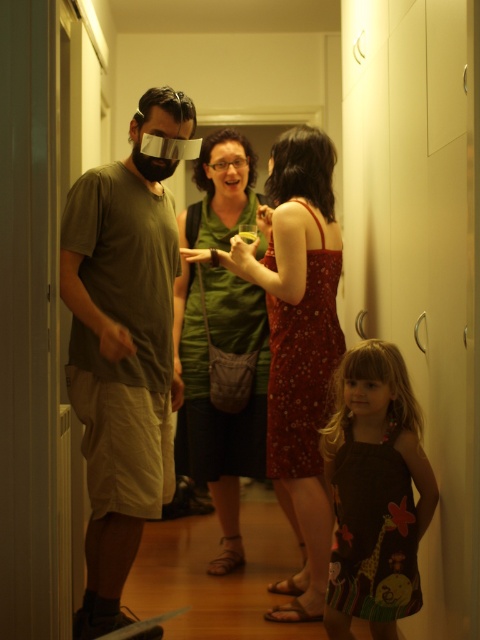
Between point (99, 353) and point (264, 460), which one is positioned behind?

Point (264, 460)

Is point (96, 179) positioned before point (259, 300)?

Yes, it is.

Between point (126, 412) and point (187, 424), which one is positioned in front?

Point (126, 412) is more forward.

At what (x,y) coordinates should I click in order to perform the action: click on matte green t-shirt at left. Please return your answer as a coordinate pair (x, y). The image size is (480, 640). Looking at the image, I should click on (122, 348).

Consider the image. Can you confirm if matte green t-shirt at left is taller than matte green dress at center?

Correct, matte green t-shirt at left is much taller as matte green dress at center.

Which is in front, point (103, 476) or point (103, 264)?

Point (103, 476) is more forward.

What do you see at coordinates (122, 348) in the screenshot? I see `matte green t-shirt at left` at bounding box center [122, 348].

Image resolution: width=480 pixels, height=640 pixels. What are the coordinates of `matte green t-shirt at left` in the screenshot? It's located at (122, 348).

Between matte green t-shirt at left and floral fabric dress at center, which one has less height?

matte green t-shirt at left is shorter.

Can you confirm if matte green t-shirt at left is positioned to the right of floral fabric dress at center?

No, matte green t-shirt at left is not to the right of floral fabric dress at center.

At what (x,y) coordinates should I click in order to perform the action: click on matte green t-shirt at left. Please return your answer as a coordinate pair (x, y). This screenshot has height=640, width=480. Looking at the image, I should click on (122, 348).